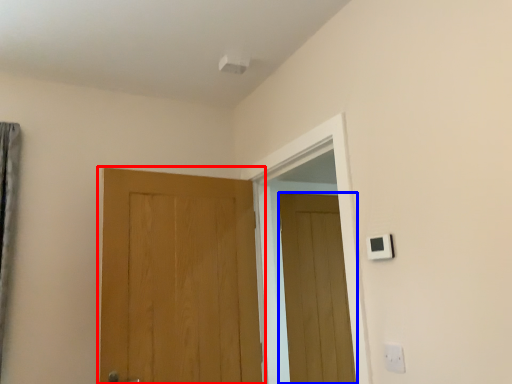
Question: Which point is closer to the camera, door (highlighted by a red box) or door (highlighted by a blue box)?

Choices:
 (A) door
 (B) door

Answer: (A)